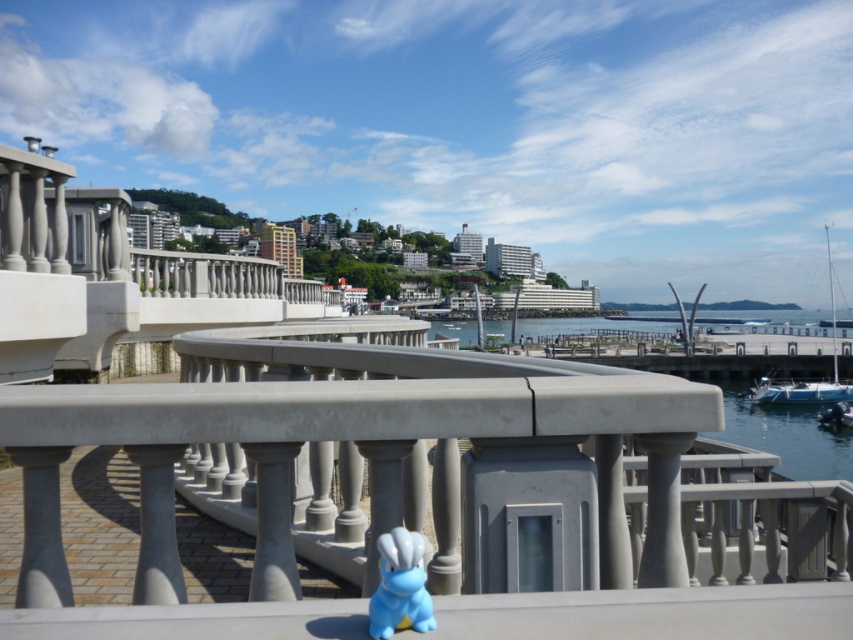
You are a delivery drone that needs to fly from the clear water at center to the blue plastic boat at lower right. What is the minimum distance you must travel to reach your destination?

The minimum distance between the clear water at center and the blue plastic boat at lower right is 25.90 meters, so you must travel at least 25.90 meters to reach the destination.

You are a child who wants to place both the blue rubber duck at center and the blue plastic boat at lower right on the curved stone railing. Since the railing has limited space, can you fit both items side by side without overlapping?

The blue rubber duck at center has a lesser width compared to blue plastic boat at lower right. However, without knowing the exact dimensions of the railing or the combined width of both items, it is impossible to determine if they can fit side by side without overlapping.

You are standing on the balcony and want to look at the clear water at center. Which direction should you move your head to look at the point marked by the coordinates point (764,410)?

The point (764,410) corresponds to the clear water at center, so you should look straight ahead to see it.